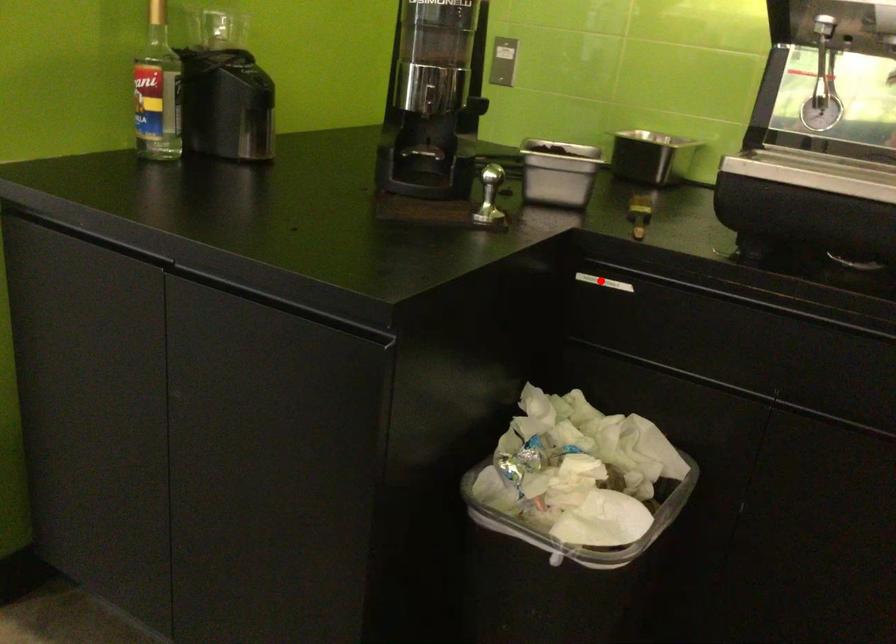
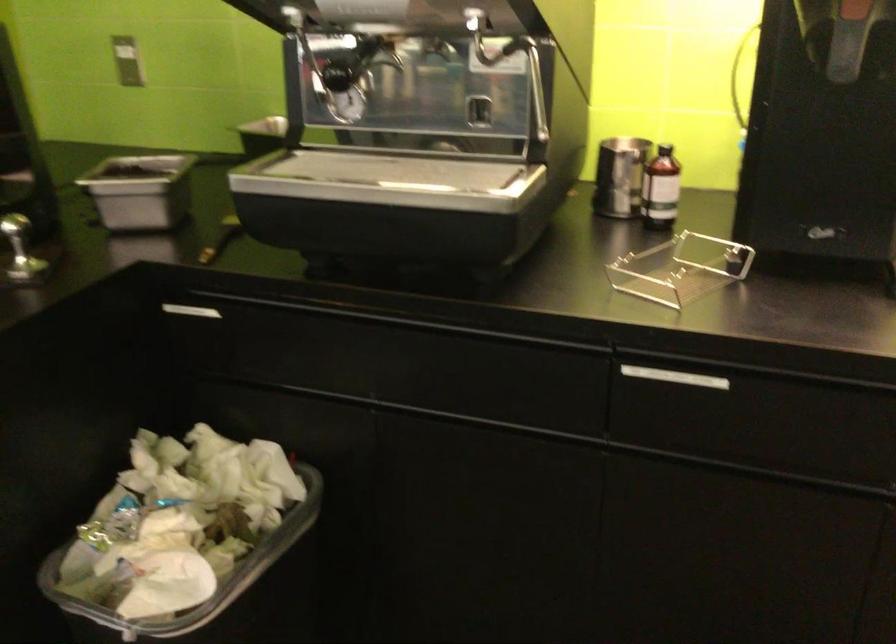
The point at the highlighted location is marked in the first image. Where is the corresponding point in the second image?

(192, 310)